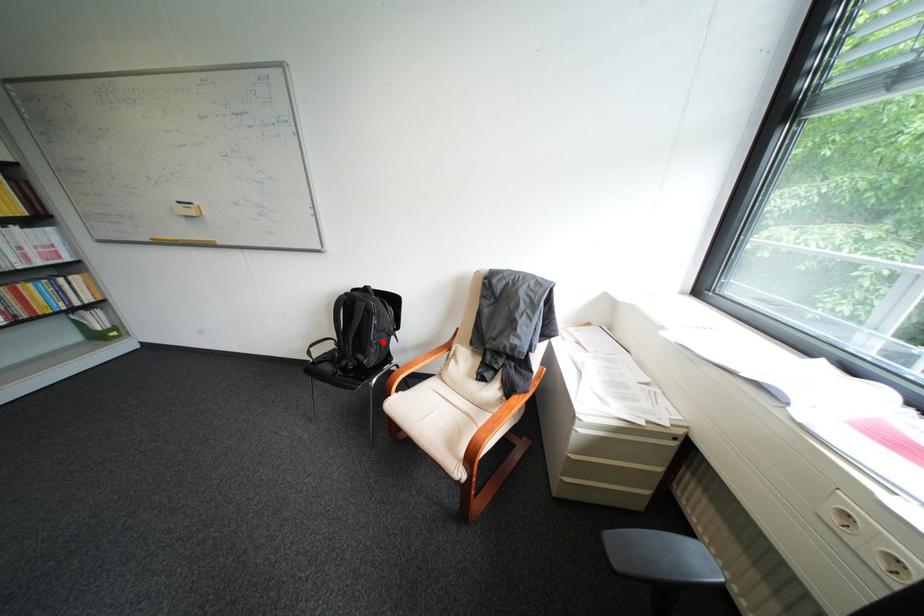
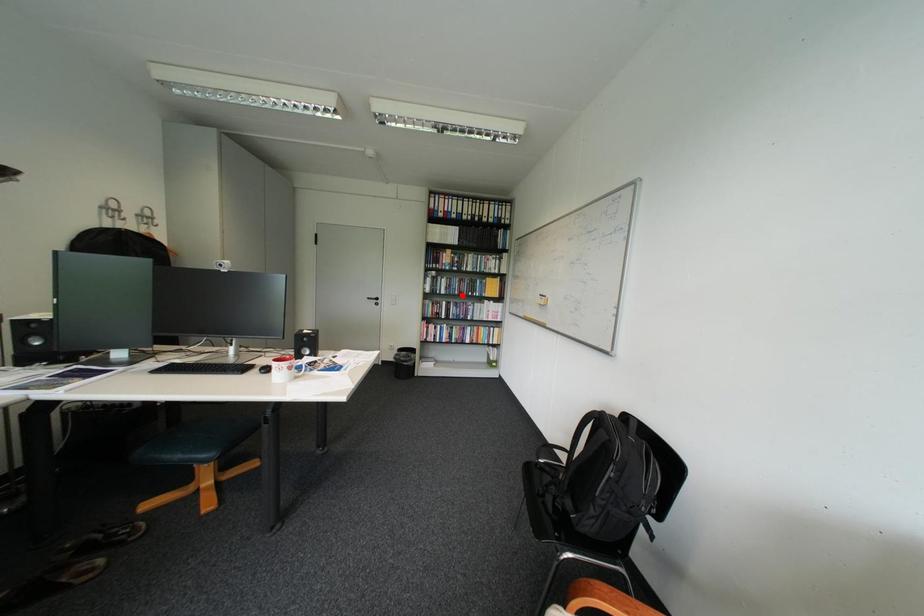
I am providing you with two images of the same scene from different viewpoints. A red point is marked on the first image and another point is marked on the second image. Are the points marked in image1 and image2 representing the same 3D position?

No